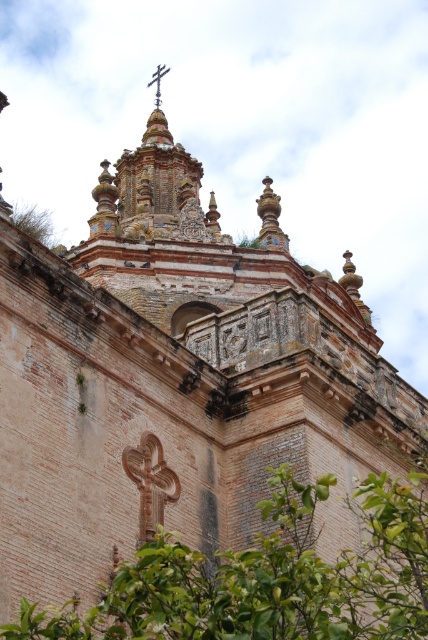
Question: Which point is closer to the camera taking this photo?

Choices:
 (A) (35, 211)
 (B) (380, 618)

Answer: (B)

Question: Among these objects, which one is farthest from the camera?

Choices:
 (A) green leafy tree at center
 (B) green leafy tree at upper left

Answer: (B)

Question: Does green leafy tree at center appear on the right side of green leafy tree at upper left?

Choices:
 (A) no
 (B) yes

Answer: (B)

Question: Which object is farther from the camera taking this photo?

Choices:
 (A) green leafy tree at upper left
 (B) green leafy tree at center

Answer: (A)

Question: Is green leafy tree at center below green leafy tree at upper left?

Choices:
 (A) yes
 (B) no

Answer: (A)

Question: Is green leafy tree at center to the left of green leafy tree at upper left from the viewer's perspective?

Choices:
 (A) no
 (B) yes

Answer: (A)